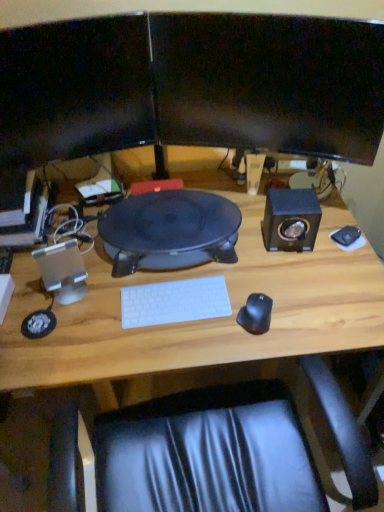
Identify the location of free space that is in between black matte speaker at right, which is counted as the first speaker, starting from the right, and matte black speaker at center. (257, 234).